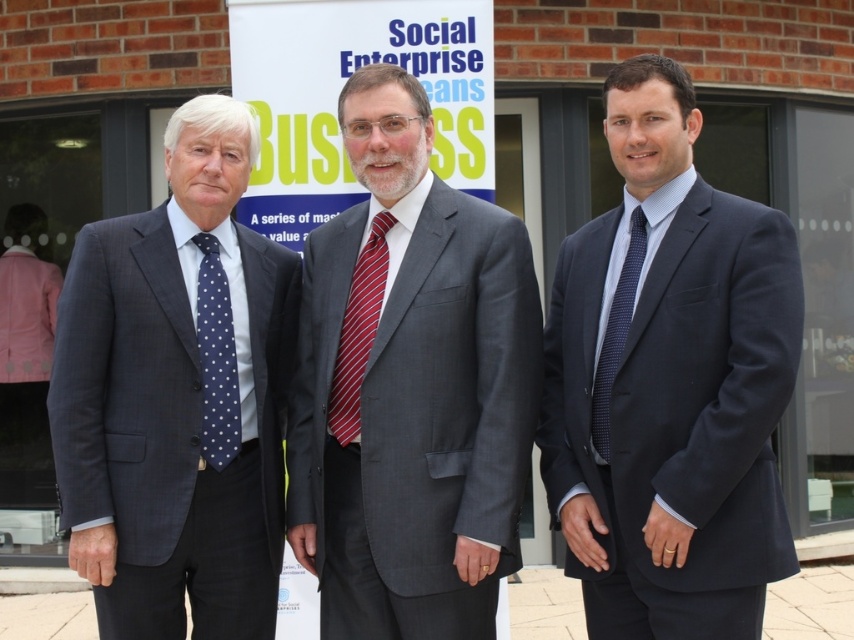
You are a photographer trying to capture a group photo of the three men standing in front of the brick building. You need to ensure that the red striped tie at center and the dark blue dotted tie at center are both clearly visible in the photo. Given that the camera has a maximum focus range of 90 centimeters, will you be able to capture both ties in focus?

The red striped tie at center is 89.77 centimeters from the dark blue dotted tie at center. Since the distance between them is less than the camera maximum focus range of 90 centimeters, both ties can be captured in focus.

You are a photographer adjusting camera settings to capture a group photo of three men in front of a brick building. You need to ensure the matte blue suit at left and navy dotted tie at left are clearly visible. Which item requires more focus adjustment due to its size?

The matte blue suit at left is larger in size than the navy dotted tie at left, so the focus adjustment should prioritize the larger matte blue suit at left to ensure clarity.